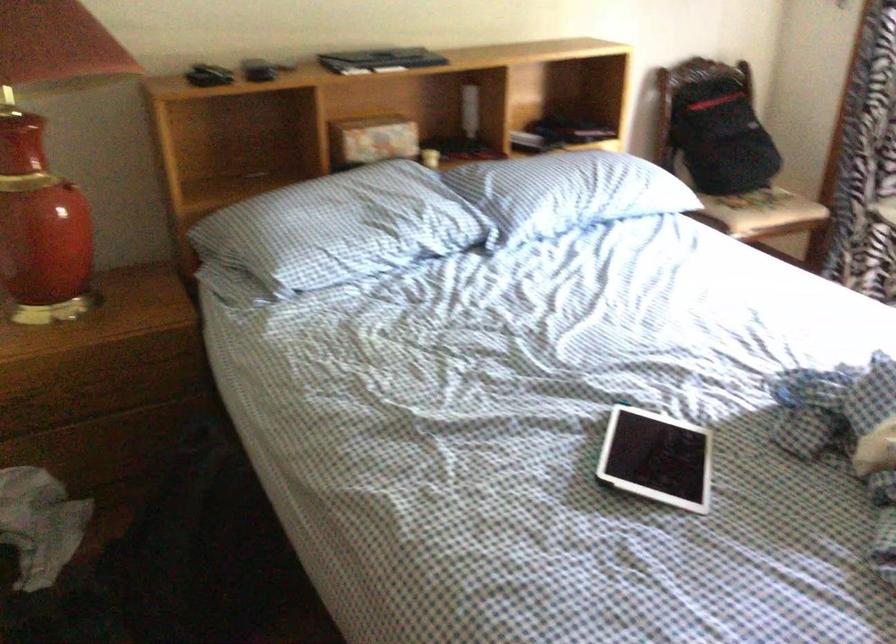
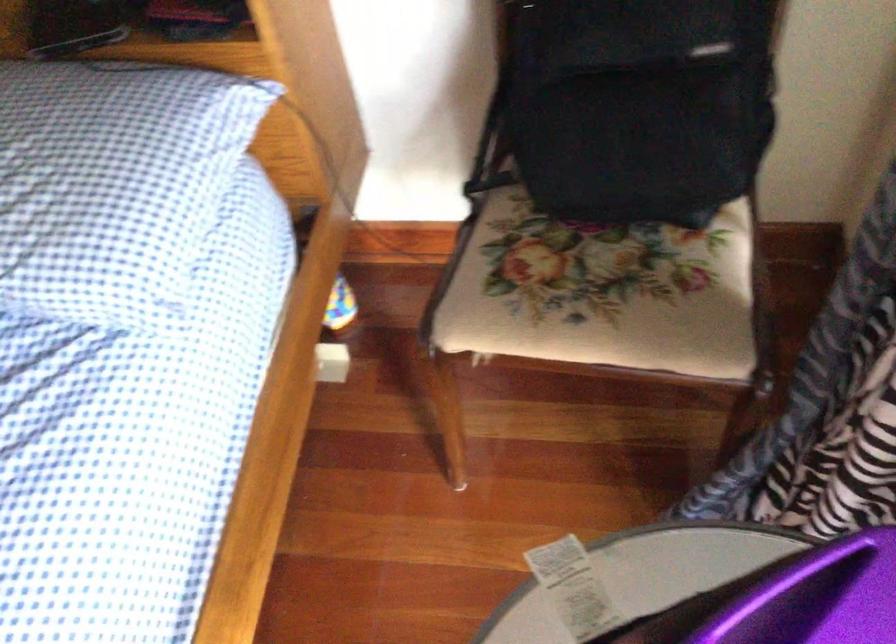
Find the pixel in the second image that matches point 784,187 in the first image.

(599, 292)